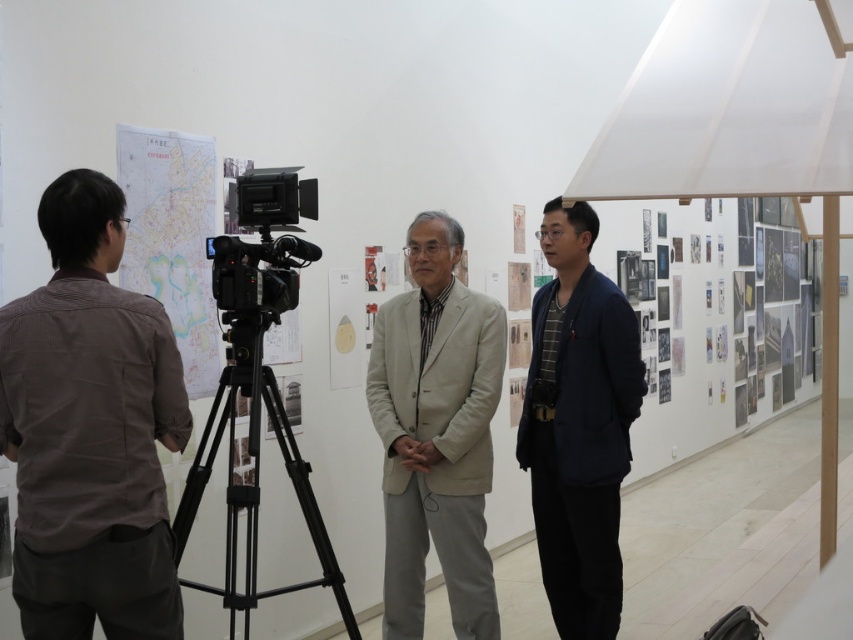
You are an event coordinator setting up for a presentation. You have a beige fabric suit at center and a matte paper map at left. Which object is closer to the ceiling?

The matte paper map at left is closer to the ceiling because the beige fabric suit at center is positioned under it.

You are a photographer setting up for a group photo in the gallery. You need to ensure that the brown textured shirt at left and the dark blue suit at center are both visible in the frame. Based on their heights, which one might require you to adjust the camera angle to include their full body in the photo?

The brown textured shirt at left has a lesser height compared to dark blue suit at center. Therefore, to ensure the full body of the brown textured shirt at left is captured, you may need to lower the camera angle slightly.

You are standing in the art gallery and want to move from point A to point B. Point A is at coordinate point (x=154, y=157) and point B is at coordinate point (x=231, y=556). Which point is closer to you?

Point A at coordinate point (x=154, y=157) is closer to you because it is further to the viewer than point B at coordinate point (x=231, y=556).